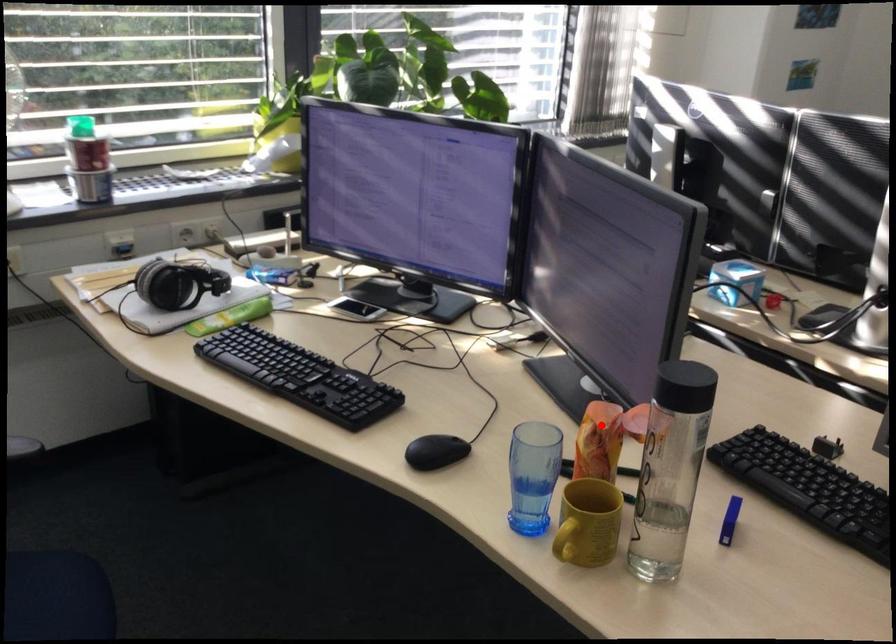
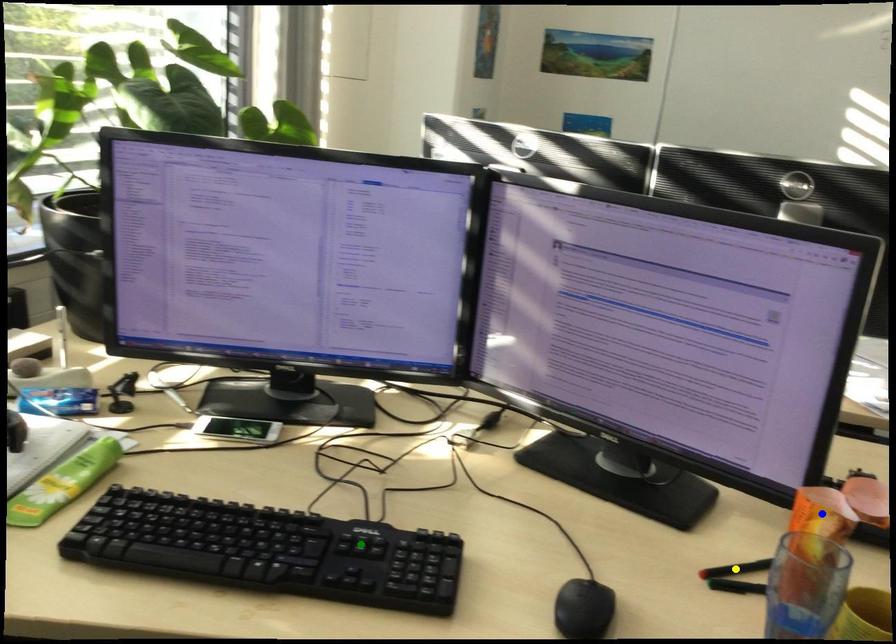
Question: I am providing you with two images of the same scene from different viewpoints. A red point is marked on the first image. You are given multiple points on the second image. In image 2, which mark is for the same physical point as the one in image 1?

Choices:
 (A) blue point
 (B) green point
 (C) yellow point

Answer: (A)